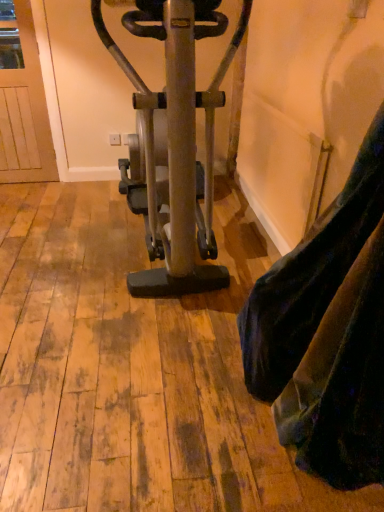
What do you see at coordinates (177, 138) in the screenshot? The height and width of the screenshot is (512, 384). I see `metallic gold stationary bicycle at center` at bounding box center [177, 138].

Find the location of `metallic gold stationary bicycle at center`. metallic gold stationary bicycle at center is located at coordinates 177,138.

This screenshot has width=384, height=512. What do you see at coordinates (327, 332) in the screenshot? I see `velvet-like fabric at lower right` at bounding box center [327, 332].

Find the location of a particular element. This screenshot has width=384, height=512. velvet-like fabric at lower right is located at coordinates (327, 332).

What is the approximate height of velvet-like fabric at lower right?

It is 1.32 meters.

Where is `metallic gold stationary bicycle at center`? The width and height of the screenshot is (384, 512). metallic gold stationary bicycle at center is located at coordinates (177, 138).

Visually, is velvet-like fabric at lower right positioned to the left or to the right of metallic gold stationary bicycle at center?

velvet-like fabric at lower right is positioned on metallic gold stationary bicycle at center's right side.

Which object is closer to the camera, velvet-like fabric at lower right or metallic gold stationary bicycle at center?

velvet-like fabric at lower right is closer to the camera.

Is point (328, 241) behind point (206, 198)?

That is False.

From the image's perspective, is velvet-like fabric at lower right positioned above or below metallic gold stationary bicycle at center?

Clearly, from the image's perspective, velvet-like fabric at lower right is below metallic gold stationary bicycle at center.

From the picture: From a real-world perspective, which is physically above, velvet-like fabric at lower right or metallic gold stationary bicycle at center?

metallic gold stationary bicycle at center.

Consider the image. Which of these two, velvet-like fabric at lower right or metallic gold stationary bicycle at center, is wider?

With larger width is metallic gold stationary bicycle at center.

Which of these two, velvet-like fabric at lower right or metallic gold stationary bicycle at center, stands shorter?

Standing shorter between the two is velvet-like fabric at lower right.

Does velvet-like fabric at lower right have a smaller size compared to metallic gold stationary bicycle at center?

Yes.

Is velvet-like fabric at lower right located outside metallic gold stationary bicycle at center?

Yes, velvet-like fabric at lower right is not within metallic gold stationary bicycle at center.

Is velvet-like fabric at lower right placed right next to metallic gold stationary bicycle at center?

There is a gap between velvet-like fabric at lower right and metallic gold stationary bicycle at center.

Is velvet-like fabric at lower right oriented away from metallic gold stationary bicycle at center?

No.

The width and height of the screenshot is (384, 512). In order to click on tight that is in front of the metallic gold stationary bicycle at center in this screenshot , I will do `click(327, 332)`.

Visually, is metallic gold stationary bicycle at center positioned to the left or to the right of velvet-like fabric at lower right?

metallic gold stationary bicycle at center is to the left of velvet-like fabric at lower right.

Is metallic gold stationary bicycle at center in front of or behind velvet-like fabric at lower right in the image?

Clearly, metallic gold stationary bicycle at center is behind velvet-like fabric at lower right.

Which point is more distant from viewer, (204,289) or (249,376)?

The point (204,289) is behind.

From the image's perspective, which is above, metallic gold stationary bicycle at center or velvet-like fabric at lower right?

From the image's view, metallic gold stationary bicycle at center is above.

From a real-world perspective, which is physically below, metallic gold stationary bicycle at center or velvet-like fabric at lower right?

In real-world perspective, velvet-like fabric at lower right is lower.

Is metallic gold stationary bicycle at center thinner than velvet-like fabric at lower right?

Incorrect, the width of metallic gold stationary bicycle at center is not less than that of velvet-like fabric at lower right.

Which of these two, metallic gold stationary bicycle at center or velvet-like fabric at lower right, stands taller?

metallic gold stationary bicycle at center.

Considering the relative sizes of metallic gold stationary bicycle at center and velvet-like fabric at lower right in the image provided, is metallic gold stationary bicycle at center smaller than velvet-like fabric at lower right?

Incorrect, metallic gold stationary bicycle at center is not smaller in size than velvet-like fabric at lower right.

Is metallic gold stationary bicycle at center surrounding velvet-like fabric at lower right?

No, velvet-like fabric at lower right is not a part of metallic gold stationary bicycle at center.

Is metallic gold stationary bicycle at center directly adjacent to velvet-like fabric at lower right?

No, metallic gold stationary bicycle at center is not next to velvet-like fabric at lower right.

Is metallic gold stationary bicycle at center facing towards velvet-like fabric at lower right?

No, metallic gold stationary bicycle at center is not facing towards velvet-like fabric at lower right.

Can you tell me how much metallic gold stationary bicycle at center and velvet-like fabric at lower right differ in facing direction?

The angle between the facing direction of metallic gold stationary bicycle at center and the facing direction of velvet-like fabric at lower right is 0.199 degrees.

How far apart are metallic gold stationary bicycle at center and velvet-like fabric at lower right?

metallic gold stationary bicycle at center and velvet-like fabric at lower right are 31.12 inches apart.

Locate an element on the screen. The image size is (384, 512). tight that appears in front of the metallic gold stationary bicycle at center is located at coordinates (327, 332).

Identify the location of tight that appears in front of the metallic gold stationary bicycle at center. (327, 332).

Find the location of a particular element. stationary bicycle above the velvet-like fabric at lower right (from a real-world perspective) is located at coordinates (177, 138).